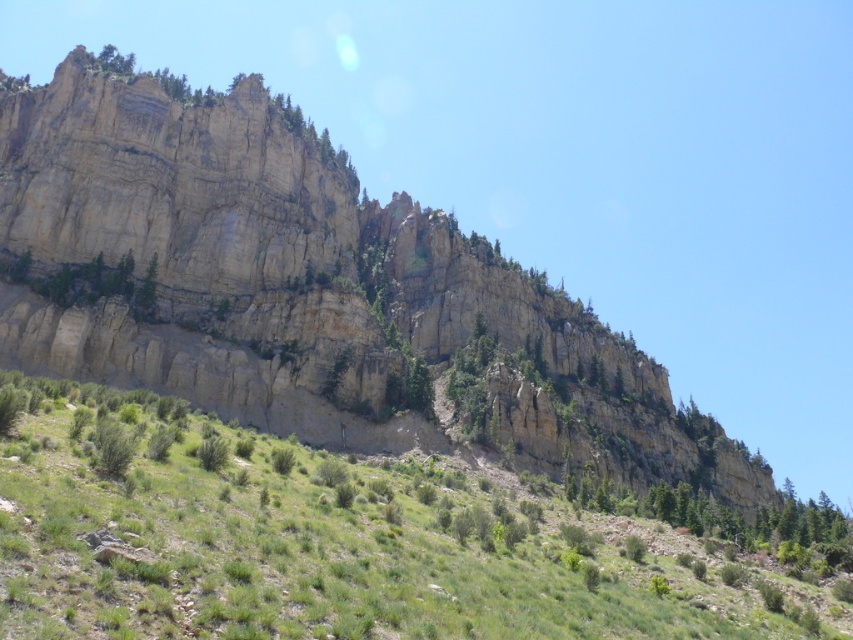
In the scene shown: You are a hiker standing at the base of the cliff. You see a point marked at coordinates point (364, 541). Based on the scene description, where would this point most likely be located?

The point (364, 541) is on the green grassy hillside at lower center, which is below the steep cliff face and part of the semi arid environment with small shrubs and patches of greenery.

You are an environmental scientist assessing the terrain. You need to determine which area has a higher elevation between the green grassy hillside at lower center and the green matte tree at center. Based on the scene, which one is taller?

The green grassy hillside at lower center is much taller than the green matte tree at center, so the green grassy hillside at lower center has a higher elevation.

You are a hiker planning to climb the rugged stone mountain at upper center and also want to take a photo of the green matte tree at center from its base. Considering their sizes, which object will appear bigger in your photo?

The rugged stone mountain at upper center will appear bigger in the photo because it is larger in size than the green matte tree at center.